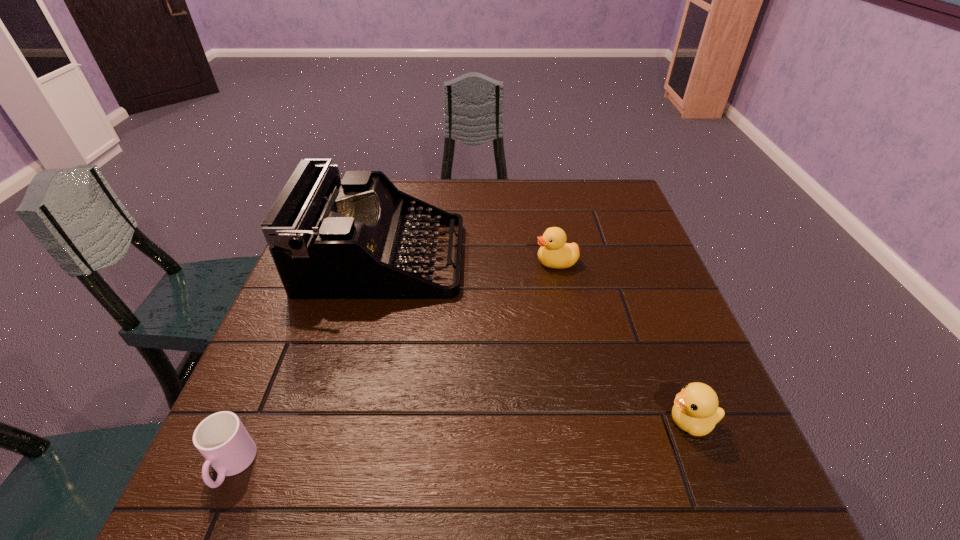
Where is `free space between the left duck and the tallest object`? free space between the left duck and the tallest object is located at coordinates (469, 260).

The height and width of the screenshot is (540, 960). Identify the location of free space between the third object from left to right and the tallest object. (469, 260).

Find the location of a particular element. Image resolution: width=960 pixels, height=540 pixels. free spot between the right duck and the tallest object is located at coordinates (537, 340).

Choose which object is the third nearest neighbor to the left duck. Please provide its 2D coordinates. Your answer should be formatted as a tuple, i.e. [(x, y)], where the tuple contains the x and y coordinates of a point satisfying the conditions above.

[(222, 439)]

Locate which object is the closest to the tallest object. Please provide its 2D coordinates. Your answer should be formatted as a tuple, i.e. [(x, y)], where the tuple contains the x and y coordinates of a point satisfying the conditions above.

[(554, 252)]

Locate an element on the screen. The height and width of the screenshot is (540, 960). free space that satisfies the following two spatial constraints: 1. at the beak of the left duck; 2. with the handle on the side of the cup is located at coordinates (596, 466).